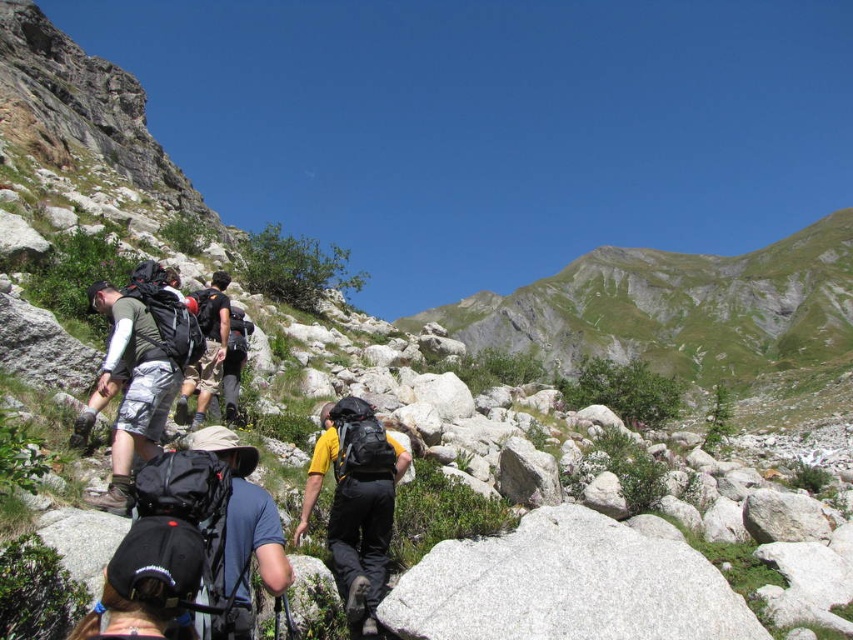
Question: Which point is farther to the camera?

Choices:
 (A) camouflage shorts at left
 (B) yellow matte backpack at center
 (C) gray rocky mountain at upper center

Answer: (C)

Question: Which point is closer to the camera taking this photo?

Choices:
 (A) (154, 348)
 (B) (228, 278)
 (C) (138, 564)

Answer: (C)

Question: From the image, what is the correct spatial relationship of gray rocky mountain at upper center in relation to camouflage shorts at center?

Choices:
 (A) below
 (B) above

Answer: (B)

Question: From the image, what is the correct spatial relationship of gray rocky mountain at upper center in relation to yellow matte backpack at center?

Choices:
 (A) above
 (B) below

Answer: (A)

Question: Which object is the closest to the camouflage shorts at left?

Choices:
 (A) gray rocky mountain at upper center
 (B) yellow matte backpack at center
 (C) camouflage shorts at center

Answer: (C)

Question: Can you confirm if gray rocky mountain at upper center is thinner than camouflage shorts at left?

Choices:
 (A) yes
 (B) no

Answer: (B)